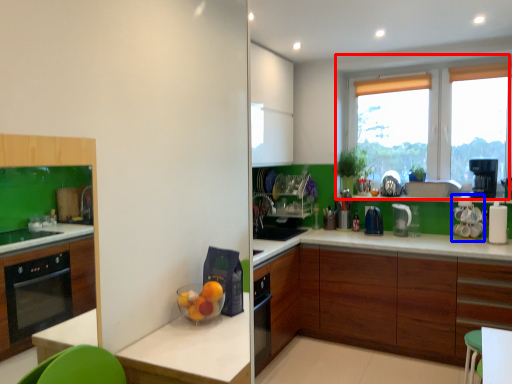
Question: Which of the following is the farthest to the observer, window (highlighted by a red box) or appliance (highlighted by a blue box)?

Choices:
 (A) window
 (B) appliance

Answer: (A)